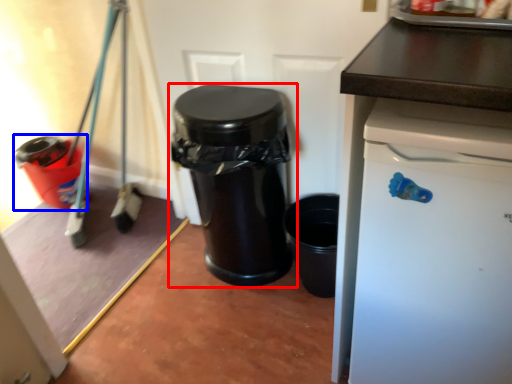
Question: Which point is closer to the camera, waste container (highlighted by a red box) or waste container (highlighted by a blue box)?

Choices:
 (A) waste container
 (B) waste container

Answer: (A)